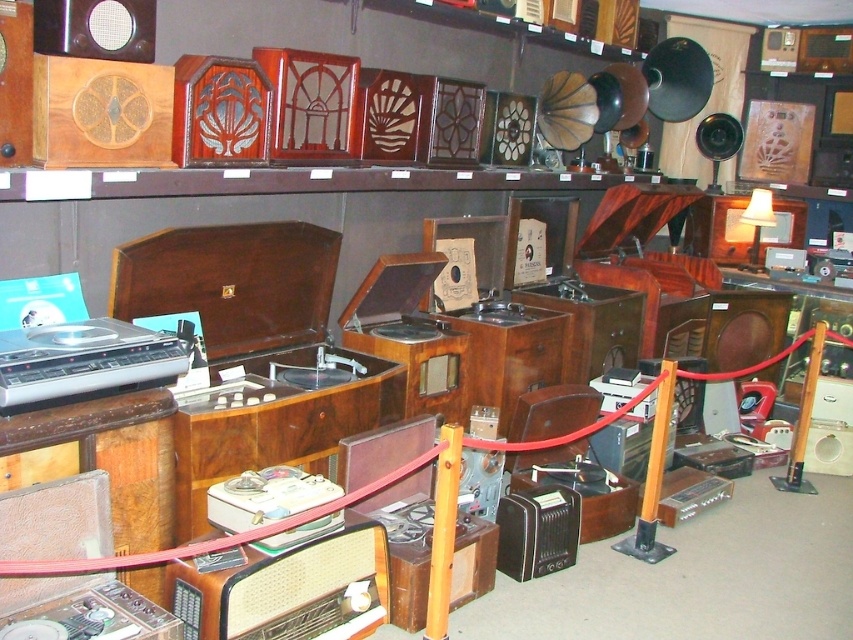
Does silver metallic turntable at left appear on the right side of matte black speaker at upper left?

No, silver metallic turntable at left is not to the right of matte black speaker at upper left.

Measure the distance between point [120,344] and camera.

Point [120,344] and camera are 7.42 feet apart from each other.

This screenshot has width=853, height=640. In order to click on silver metallic turntable at left in this screenshot , I will do `click(86, 362)`.